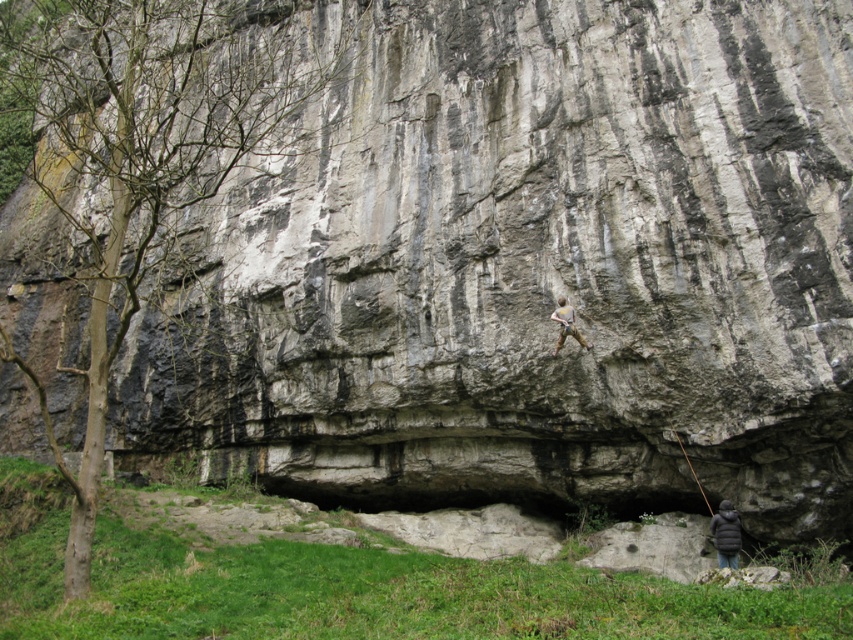
Is bare wood tree at left bigger than camouflage pants at center?

Yes.

Which is in front, point (84, 474) or point (584, 346)?

Point (84, 474) is more forward.

What do you see at coordinates (142, 161) in the screenshot? I see `bare wood tree at left` at bounding box center [142, 161].

Where is `bare wood tree at left`? The image size is (853, 640). bare wood tree at left is located at coordinates (142, 161).

The height and width of the screenshot is (640, 853). What do you see at coordinates (142, 161) in the screenshot?
I see `bare wood tree at left` at bounding box center [142, 161].

Find the location of a particular element. bare wood tree at left is located at coordinates (142, 161).

Between point (721, 500) and point (558, 321), which one is positioned behind?

The point (721, 500) is more distant.

Between point (737, 545) and point (561, 321), which one is positioned in front?

Point (737, 545) is more forward.

The width and height of the screenshot is (853, 640). Find the location of `dark gray puffy jacket at lower right`. dark gray puffy jacket at lower right is located at coordinates (726, 534).